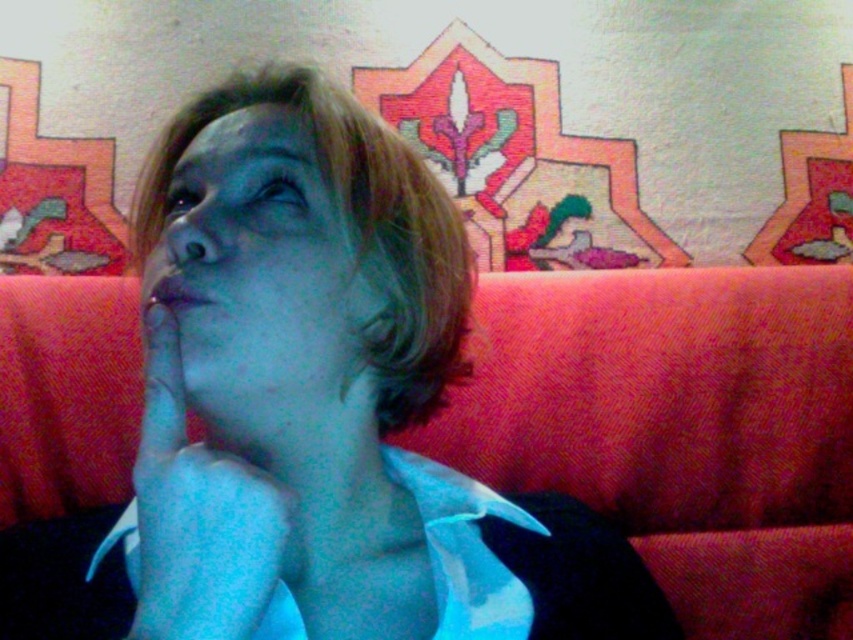
Which is in front, point (585, 440) or point (196, 342)?

Point (196, 342) is in front.

Locate an element on the screen. The image size is (853, 640). orange fabric couch at center is located at coordinates (677, 428).

Is point (57, 465) behind point (173, 204)?

Yes, it is behind point (173, 204).

You are a GUI agent. You are given a task and a screenshot of the screen. Output one action in this format:
    pyautogui.click(x=<x>, y=<y>)
    Task: Click on the orange fabric couch at center
    The height and width of the screenshot is (640, 853).
    Given the screenshot: What is the action you would take?
    pyautogui.click(x=677, y=428)

Which is in front, point (263, 369) or point (283, 500)?

Point (283, 500) is more forward.

Is point (198, 241) less distant than point (155, 515)?

No, (198, 241) is behind (155, 515).

Where is `blue matte face at center`? The height and width of the screenshot is (640, 853). blue matte face at center is located at coordinates (260, 268).

Is point (758, 499) closer to camera compared to point (167, 352)?

No, (758, 499) is behind (167, 352).

Does orange fabric couch at center appear over blue matte hand at center?

No, orange fabric couch at center is not above blue matte hand at center.

Is point (802, 330) positioned behind point (225, 634)?

Yes, it is.

Identify the location of orange fabric couch at center. This screenshot has height=640, width=853. (677, 428).